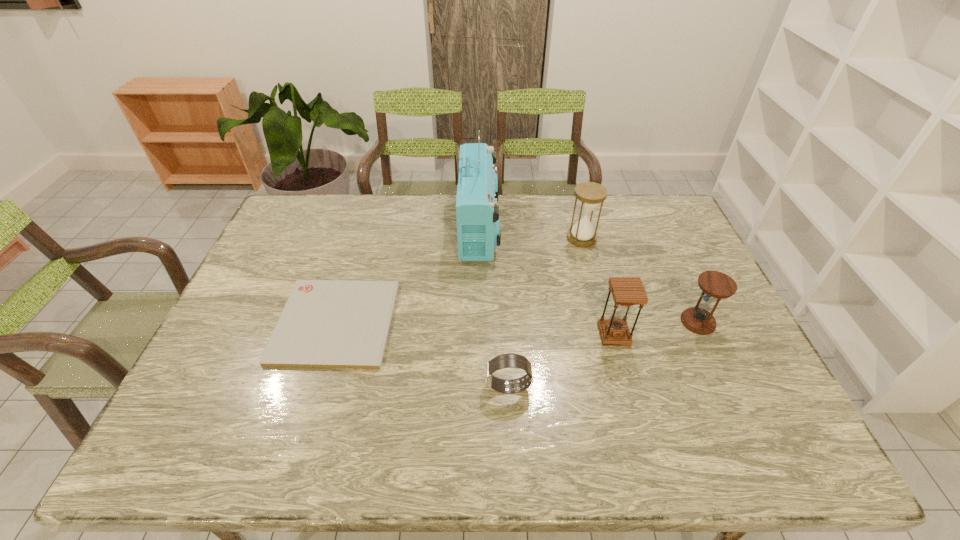
Where is `vacant space at the left edge`? The width and height of the screenshot is (960, 540). vacant space at the left edge is located at coordinates (247, 358).

In the image, there is a desktop. Identify the location of free space at the right edge. (664, 239).

This screenshot has height=540, width=960. In the image, there is a desktop. What are the coordinates of `vacant space at the far left corner` in the screenshot? It's located at (318, 194).

The image size is (960, 540). In order to click on free spot between the watch and the tallest object in this screenshot , I will do `click(493, 307)`.

Locate an element on the screen. The height and width of the screenshot is (540, 960). free space between the watch and the farthest hourglass is located at coordinates (545, 313).

I want to click on empty space between the watch and the shortest object, so click(422, 355).

Locate an element on the screen. The width and height of the screenshot is (960, 540). vacant area between the rightmost object and the radio receiver is located at coordinates (588, 275).

Where is `unoccupied position between the tallest object and the shortest object`? The width and height of the screenshot is (960, 540). unoccupied position between the tallest object and the shortest object is located at coordinates (407, 275).

Identify the location of object that is the closest to the rightmost hourglass. (x=627, y=291).

Locate an element on the screen. This screenshot has width=960, height=540. the third closest object to the farthest hourglass is located at coordinates (627, 291).